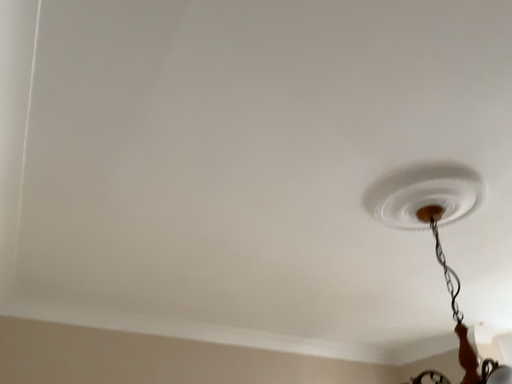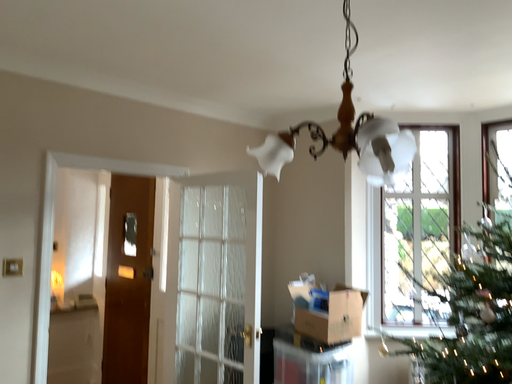
Question: Which way did the camera rotate in the video?

Choices:
 (A) rotated right
 (B) rotated left

Answer: (A)